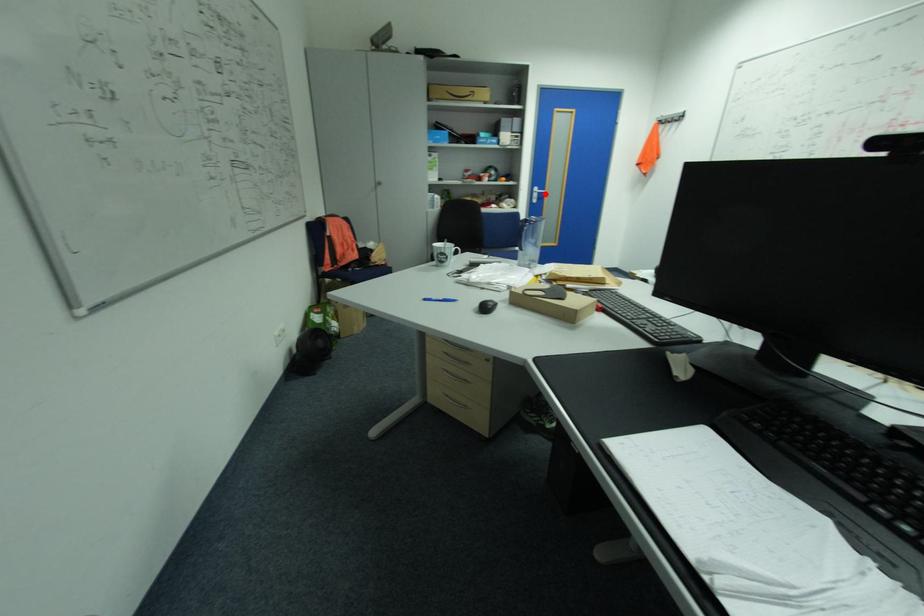
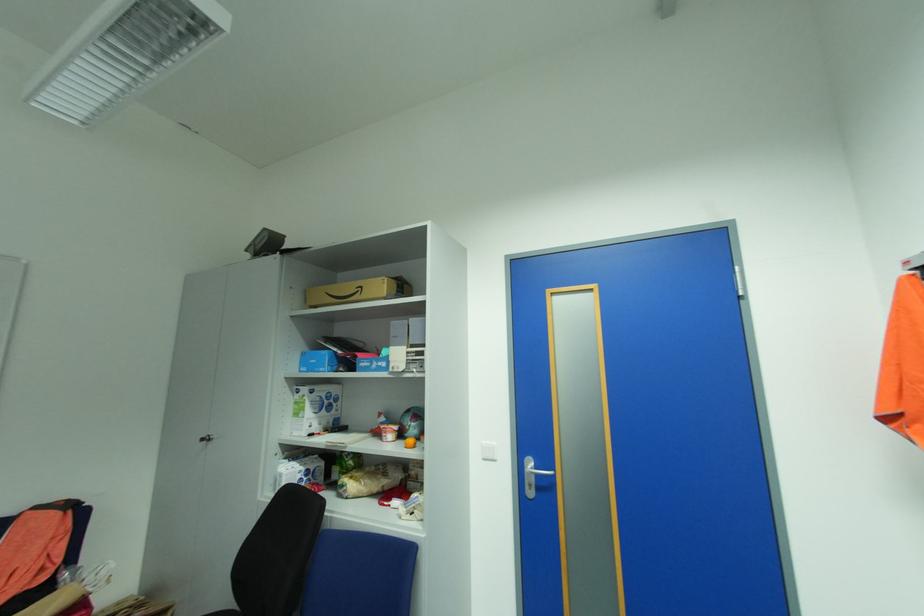
The point at the highlighted location is marked in the first image. Where is the corresponding point in the second image?

(543, 475)